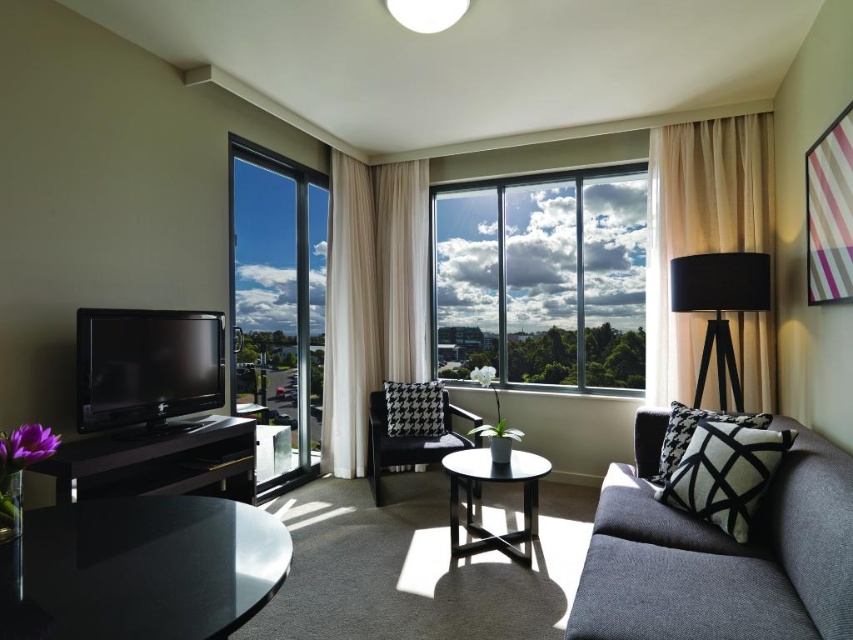
Question: Can you confirm if sheer beige curtain at right is positioned below black glossy table at lower left?

Choices:
 (A) no
 (B) yes

Answer: (A)

Question: Among these objects, which one is nearest to the camera?

Choices:
 (A) sheer beige curtain at right
 (B) black glossy table at lower left
 (C) matte black side table at center

Answer: (B)

Question: Is matte black flat screen tv at left positioned behind black glossy table at lower left?

Choices:
 (A) yes
 (B) no

Answer: (A)

Question: Can you confirm if transparent glass window at left is positioned below black glossy table at lower left?

Choices:
 (A) yes
 (B) no

Answer: (B)

Question: Which point is closer to the camera taking this photo?

Choices:
 (A) (264, 486)
 (B) (398, 451)
 (C) (642, 579)
 (D) (152, 337)

Answer: (C)

Question: Which point is closer to the camera?

Choices:
 (A) clear glass window at center
 (B) sheer beige curtain at right
 (C) glossy glass table at lower left
 (D) houndstooth fabric armchair at center

Answer: (C)